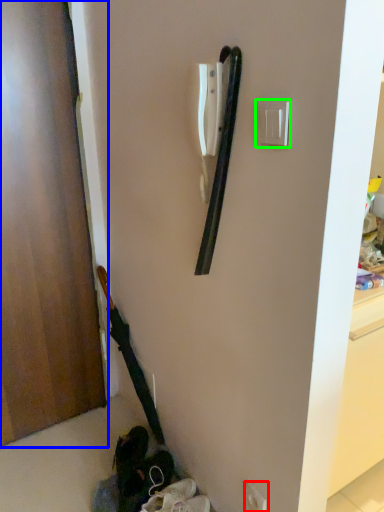
Question: Considering the real-world distances, which object is closest to electric outlet (highlighted by a red box)? door (highlighted by a blue box) or light switch (highlighted by a green box).

Choices:
 (A) door
 (B) light switch

Answer: (B)